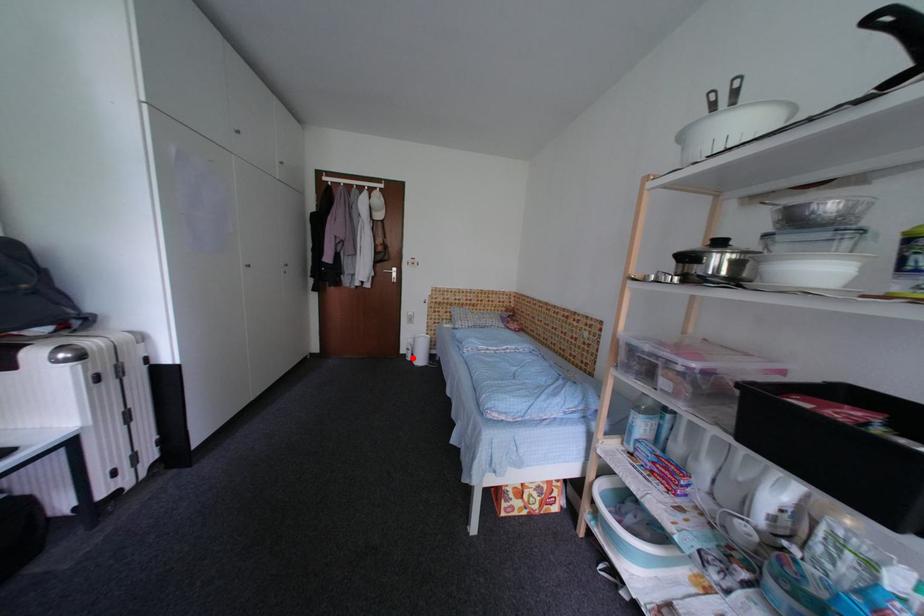
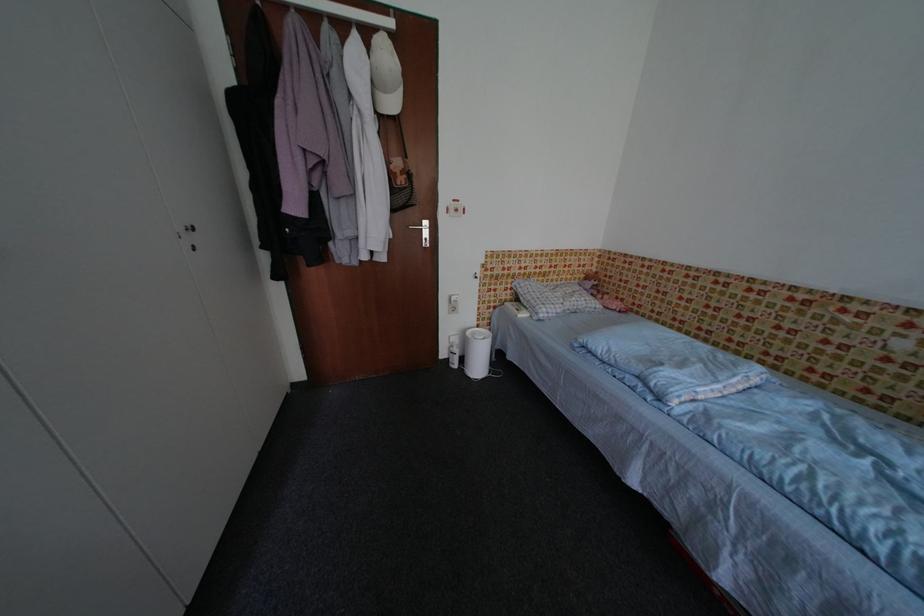
In the second image, find the point that corresponds to the highlighted location in the first image.

(455, 363)